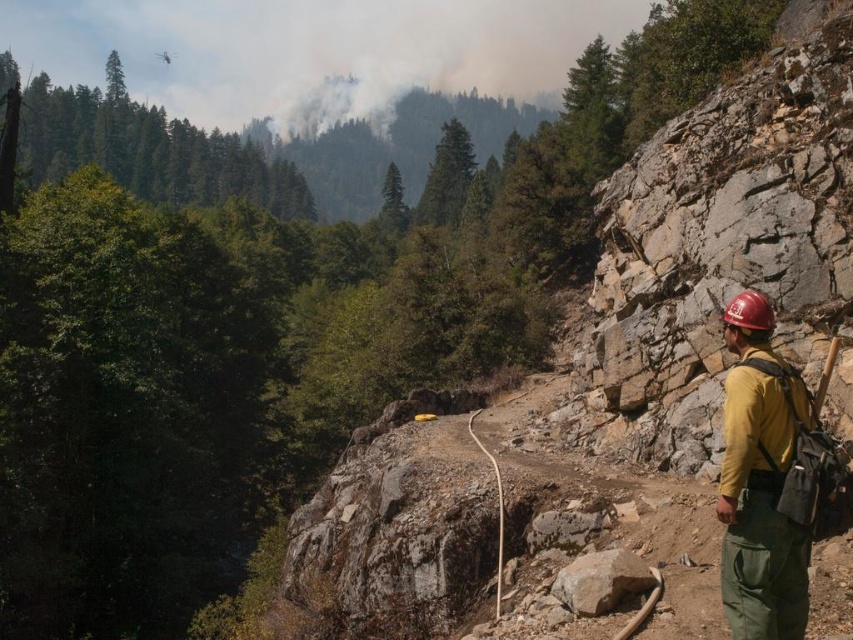
You are a safety inspector at the construction site. You notice a worker standing at point (764, 500). The safety regulations require that all workers must be at least 10 meters away from the edge of the cliff. Can you determine if the worker is within the safe distance?

The distance between point (764, 500) and the camera is 9.01 meters. Since the required safe distance is 10 meters, the worker is within 9.01 meters, which is less than the required 10 meters. Therefore, the worker is not within the safe distance and needs to move further back.

You are a hiker who just arrived at this mountain area and need to retrieve your backpack. You see the yellow fabric backpack at right and the gray rough rock at center. Which object is higher up in elevation?

Answer: The yellow fabric backpack at right is located above the gray rough rock at center, so it is higher up in elevation.